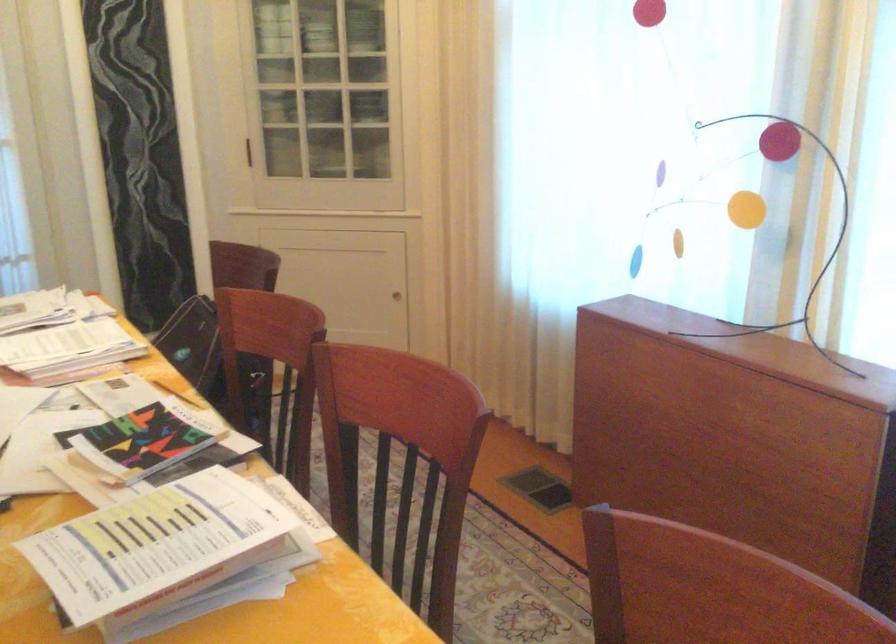
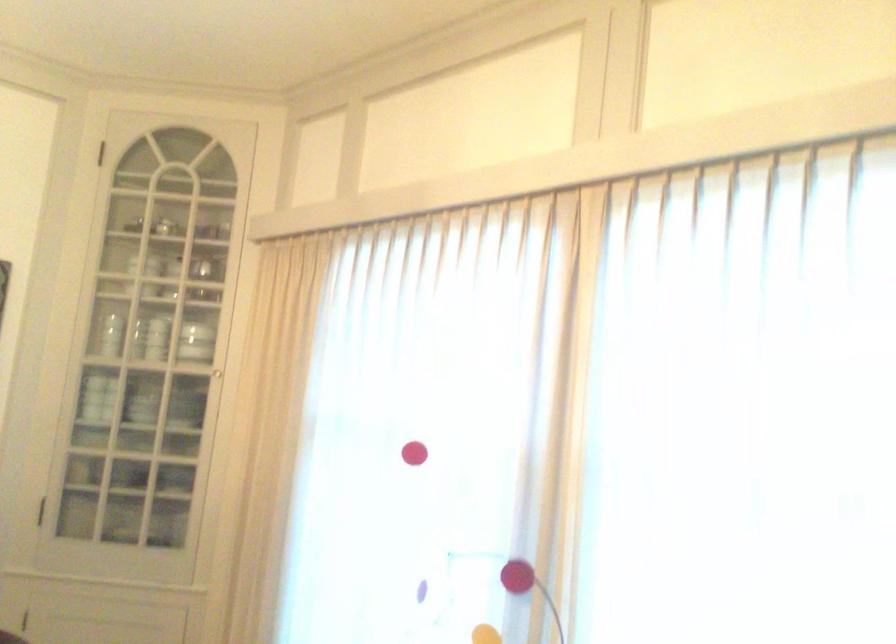
Question: Based on the continuous images, in which direction is the camera rotating? Reply with the corresponding letter.

Choices:
 (A) Left
 (B) Right
 (C) Up
 (D) Down

Answer: (C)